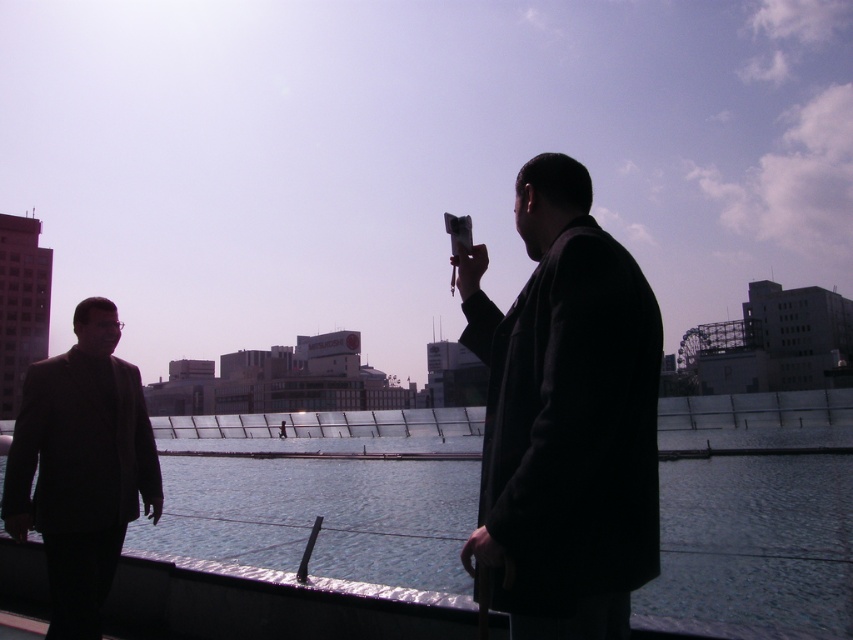
You are standing at the point labeled as point (488, 506) in the image. If you want to take a photo of the person holding the camera, which direction should you move to get a better angle?

Since the point (488, 506) is 6.65 feet away from the viewer, you should move closer to the person holding the camera to get a better angle.